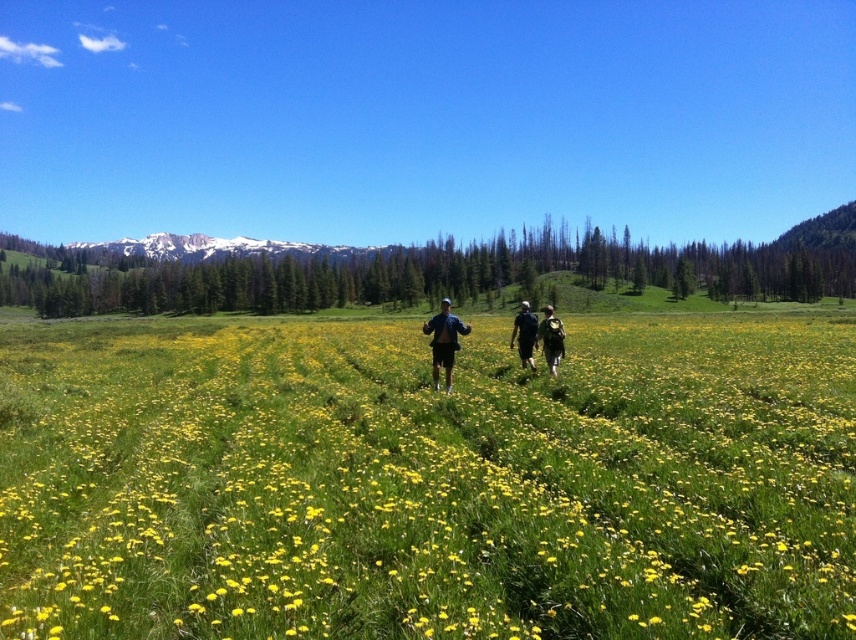
You are standing in the meadow and want to find the yellow grass at center. Based on the coordinates provided, in which direction should you look to locate it?

The yellow grass at center is located at coordinates point (428,481), so you should look towards the right side of the scene since the x coordinate is 0.752, which is closer to the right edge.

You are a photographer trying to capture the two matte black backpacks at center in a single shot. Since you want to include both backpacks in the frame, which direction should you position your camera relative to the matte black backpack at center?

The matte black backpacks at center is to the left of the matte black backpack at center, so you should position your camera to the left of the matte black backpack at center to include both backpacks in the frame.